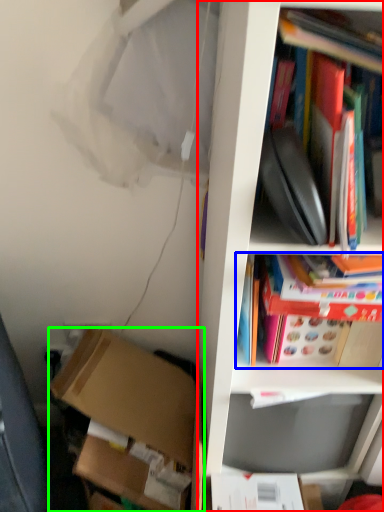
Question: Based on their relative distances, which object is nearer to cabinetry (highlighted by a red box)? Choose from book (highlighted by a blue box) and box (highlighted by a green box).

Choices:
 (A) book
 (B) box

Answer: (A)